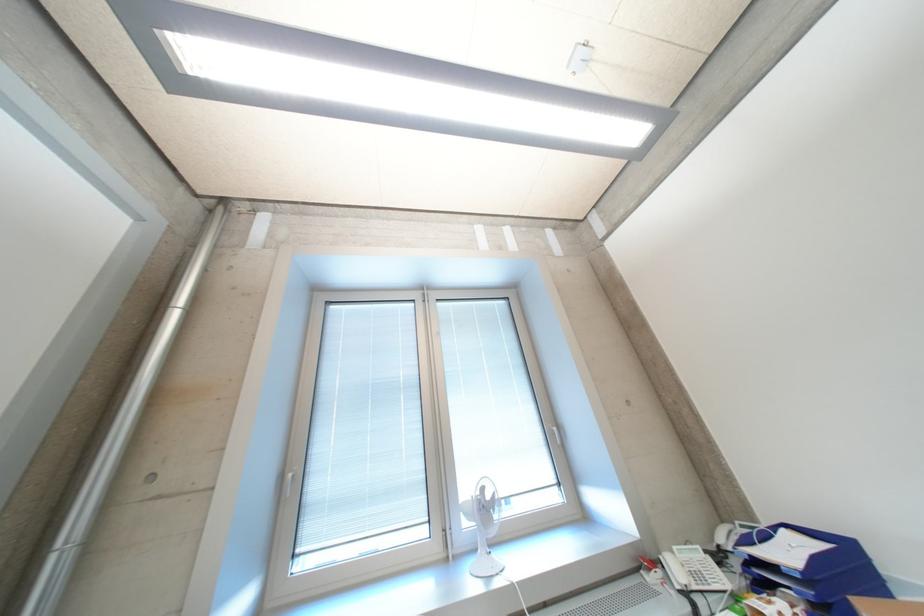
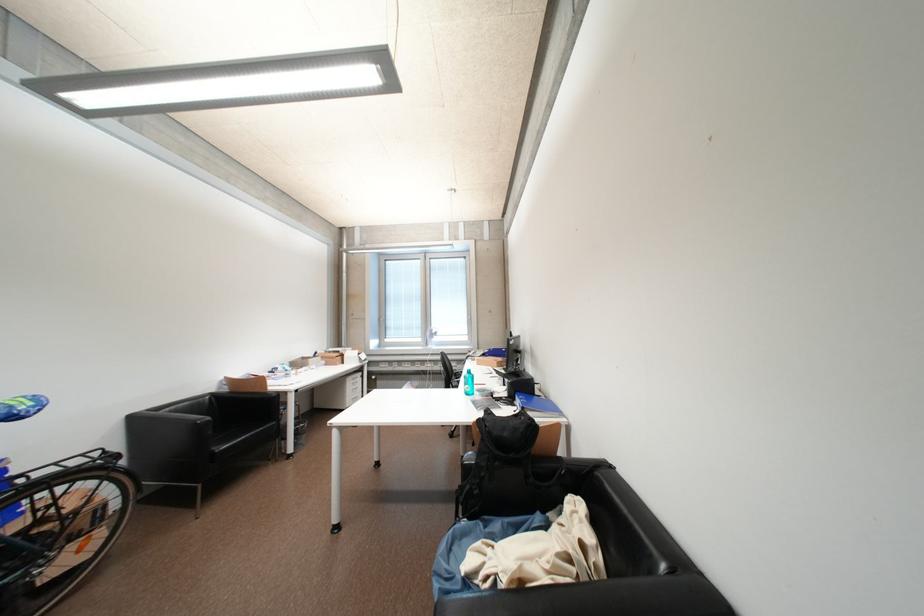
In the second image, find the point that corresponds to the point at 323,453 in the first image.

(395, 315)